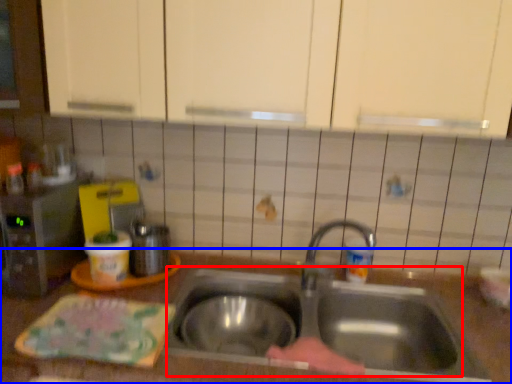
Question: Which object is closer to the camera taking this photo, sink (highlighted by a red box) or countertop (highlighted by a blue box)?

Choices:
 (A) sink
 (B) countertop

Answer: (B)